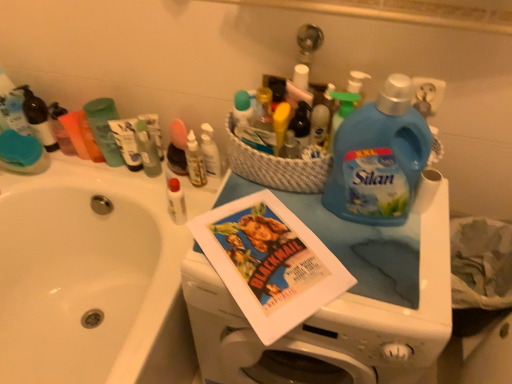
Question: Would you say blue plastic bottle at upper right, the first cleaning product viewed from the right, is inside or outside white paper at right?

Choices:
 (A) inside
 (B) outside

Answer: (B)

Question: Considering their positions, is blue plastic bottle at upper right, the 2th cleaning product positioned from the left, located in front of or behind white paper at right?

Choices:
 (A) front
 (B) behind

Answer: (A)

Question: Based on their relative distances, which object is nearer to the blue plastic spray bottle at upper center, the 2th cleaning product positioned from the right?

Choices:
 (A) matte paper comic book at center
 (B) matte black soap dispenser at upper left, which is the first toiletry in left-to-right order
 (C) blue plastic laundry detergent at upper right
 (D) white paper at right
 (E) translucent plastic bottle at center, the 1th toiletry positioned from the right

Answer: (D)

Question: Which object is positioned closest to the matte black soap dispenser at upper left, the third toiletry viewed from the right?

Choices:
 (A) matte paper comic book at center
 (B) white paper at right
 (C) blue plastic spray bottle at upper center, the 2th cleaning product positioned from the right
 (D) blue plastic laundry detergent at upper right
 (E) blue plastic bottle at upper right, the 2th cleaning product positioned from the left

Answer: (A)